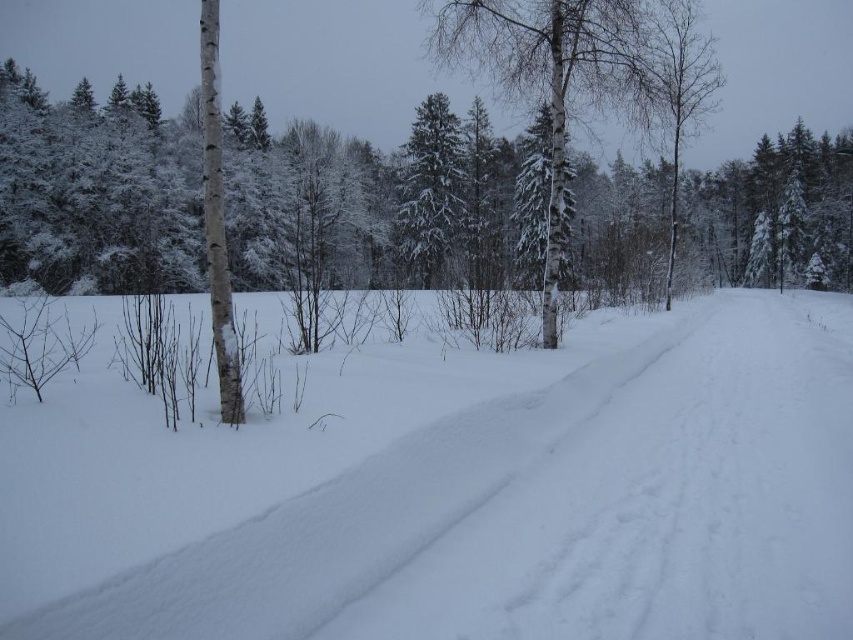
Question: Which object is farther from the camera taking this photo?

Choices:
 (A) snow-covered evergreen tree at center
 (B) white fluffy snow at center

Answer: (A)

Question: Is white fluffy snow at center further to camera compared to white smooth birch at center?

Choices:
 (A) yes
 (B) no

Answer: (B)

Question: Among these points, which one is farthest from the camera?

Choices:
 (A) (566, 104)
 (B) (395, 628)

Answer: (A)

Question: Which point is farther from the camera taking this photo?

Choices:
 (A) (347, 634)
 (B) (630, 54)

Answer: (B)

Question: Does snow-covered evergreen tree at center appear on the left side of white smooth tree at left?

Choices:
 (A) yes
 (B) no

Answer: (B)

Question: Does white fluffy snow at center have a greater width compared to white smooth birch at center?

Choices:
 (A) yes
 (B) no

Answer: (A)